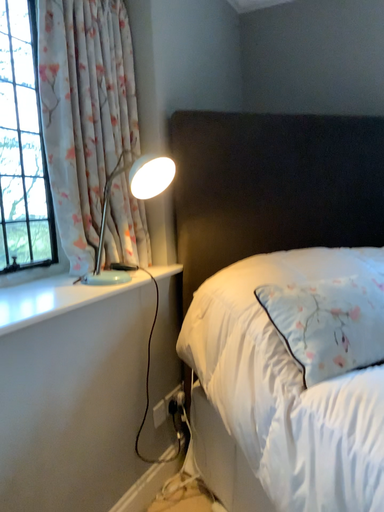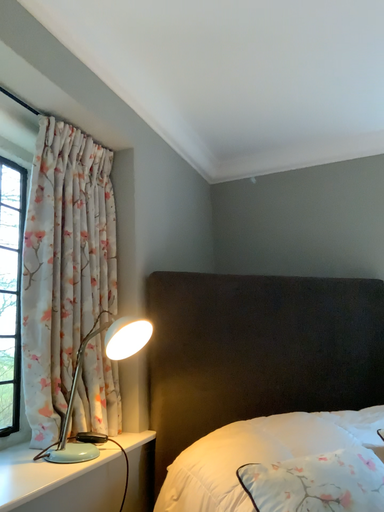
Question: Which way did the camera rotate in the video?

Choices:
 (A) rotated upward
 (B) rotated downward

Answer: (A)